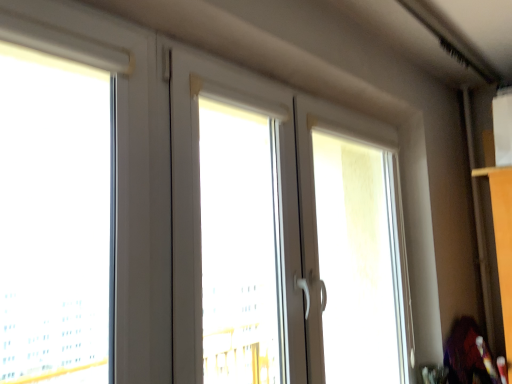
Measure the distance between white plastic window at center and camera.

The distance of white plastic window at center from camera is 3.48 feet.

What do you see at coordinates (282, 237) in the screenshot?
I see `white plastic window at center` at bounding box center [282, 237].

Identify the location of white plastic window at center. This screenshot has width=512, height=384. (282, 237).

Where is `white plastic window at center`? The height and width of the screenshot is (384, 512). white plastic window at center is located at coordinates (282, 237).